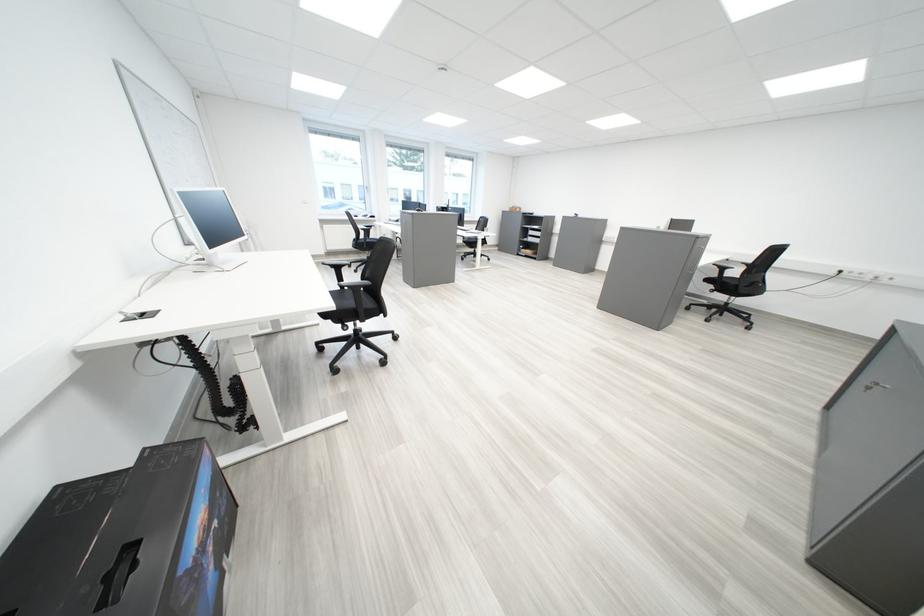
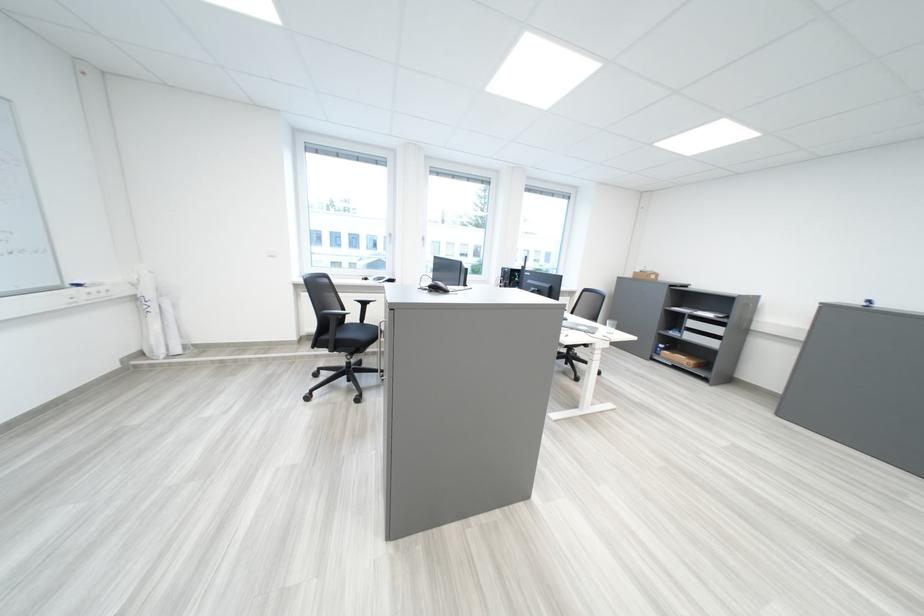
Question: What movement of the cameraman would produce the second image?

Choices:
 (A) Left
 (B) Right
 (C) Forward
 (D) Backward

Answer: (C)